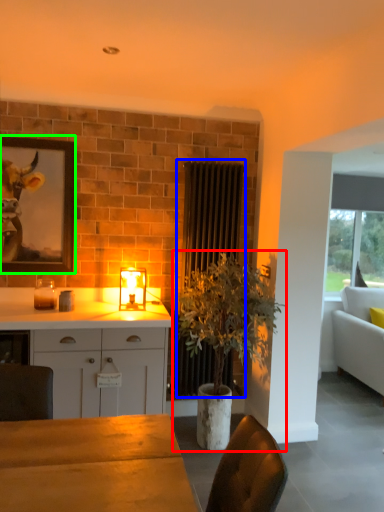
Question: Which is farther away from houseplant (highlighted by a red box)? radiator (highlighted by a blue box) or picture frame (highlighted by a green box)?

Choices:
 (A) radiator
 (B) picture frame

Answer: (B)